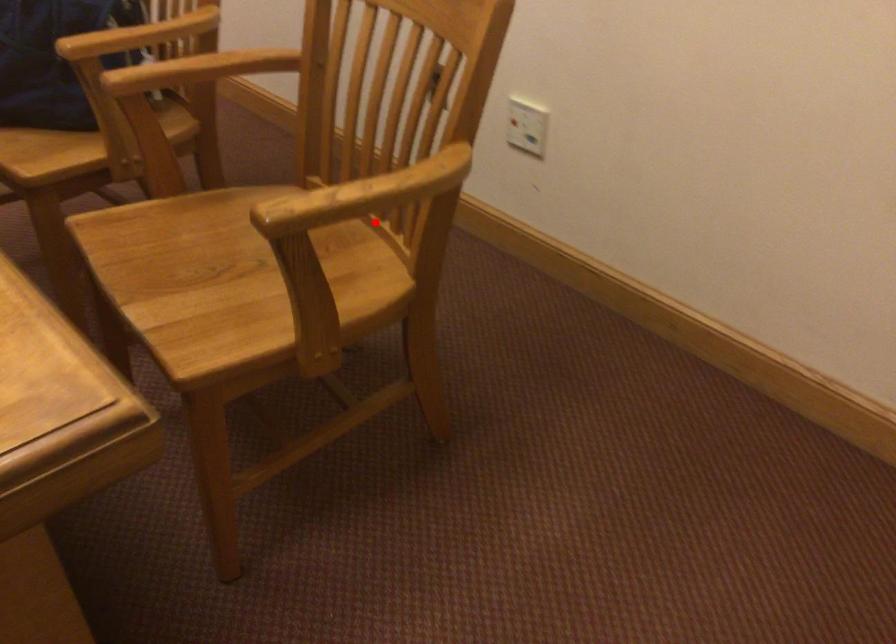
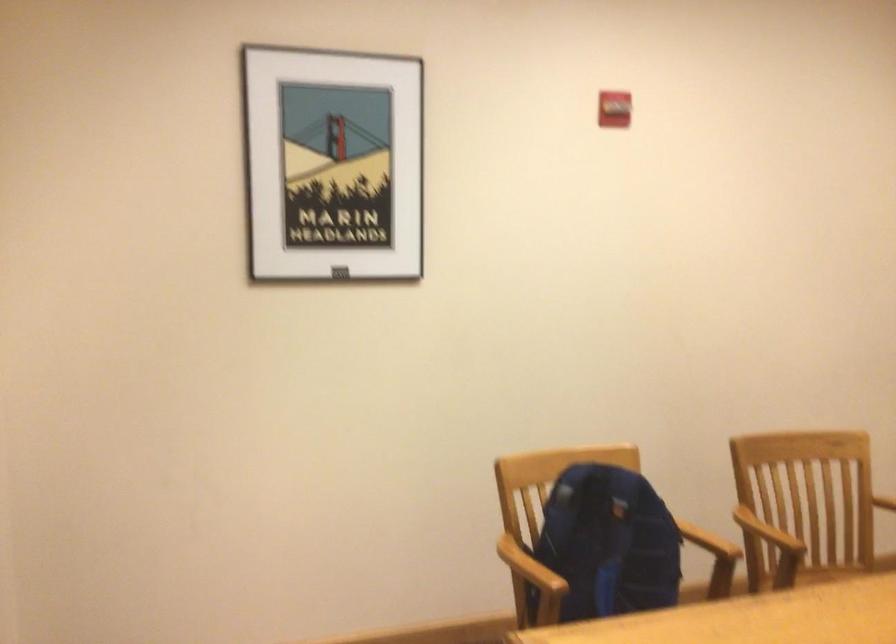
Question: A red point is marked in image1. In image2, is the corresponding 3D point closer to the camera or farther? Reply with the corresponding letter.

Choices:
 (A) The corresponding 3D point is closer.
 (B) The corresponding 3D point is farther.

Answer: (B)